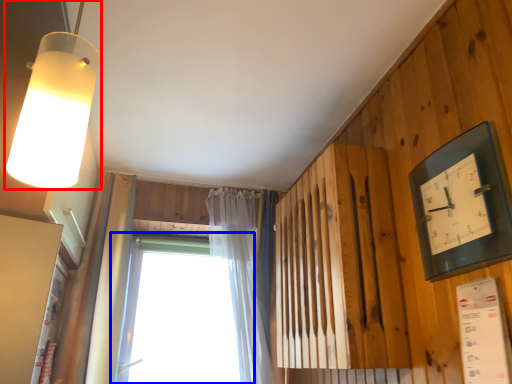
Question: Which point is further to the camera, lamp (highlighted by a red box) or window (highlighted by a blue box)?

Choices:
 (A) lamp
 (B) window

Answer: (B)